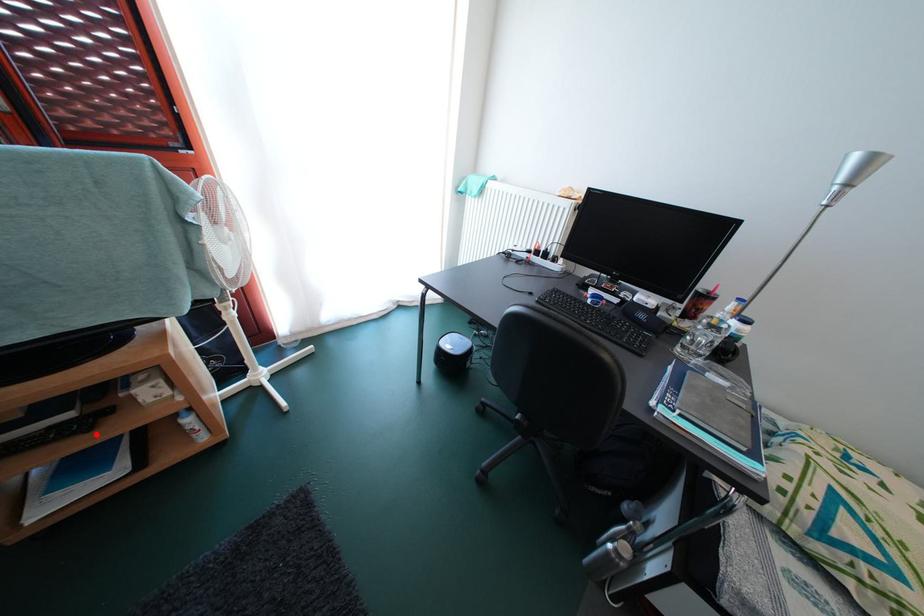
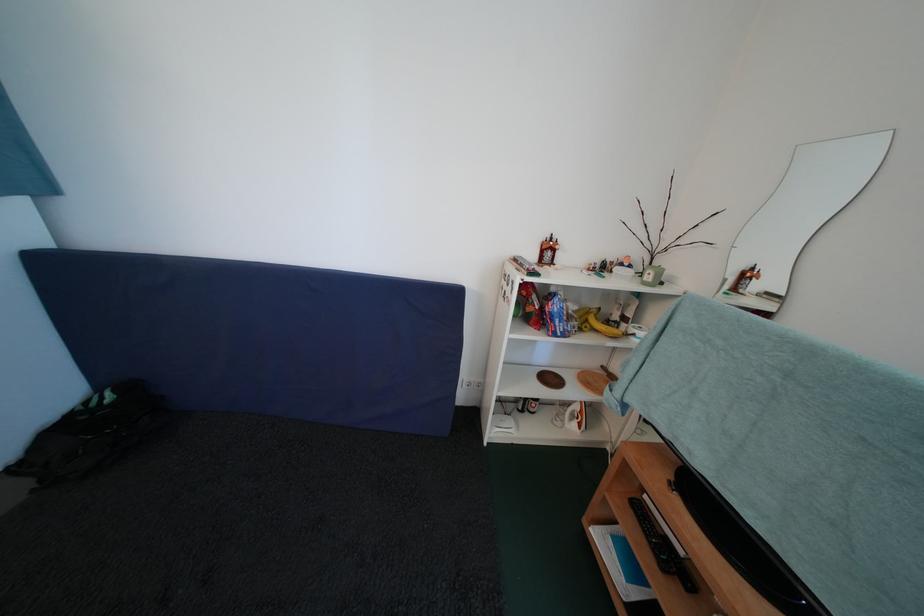
Where in the second image is the point corresponding to the highlighted location from the first image?

(671, 573)